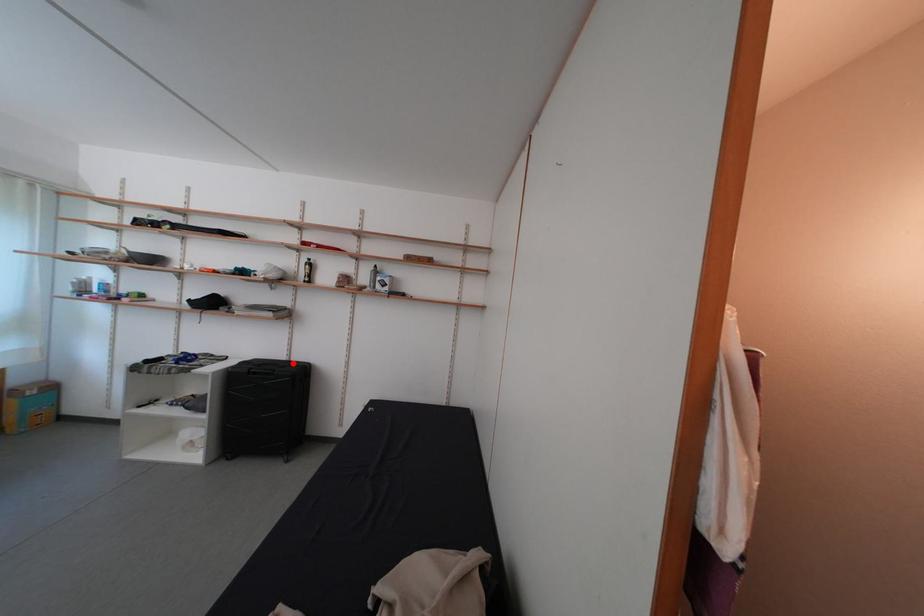
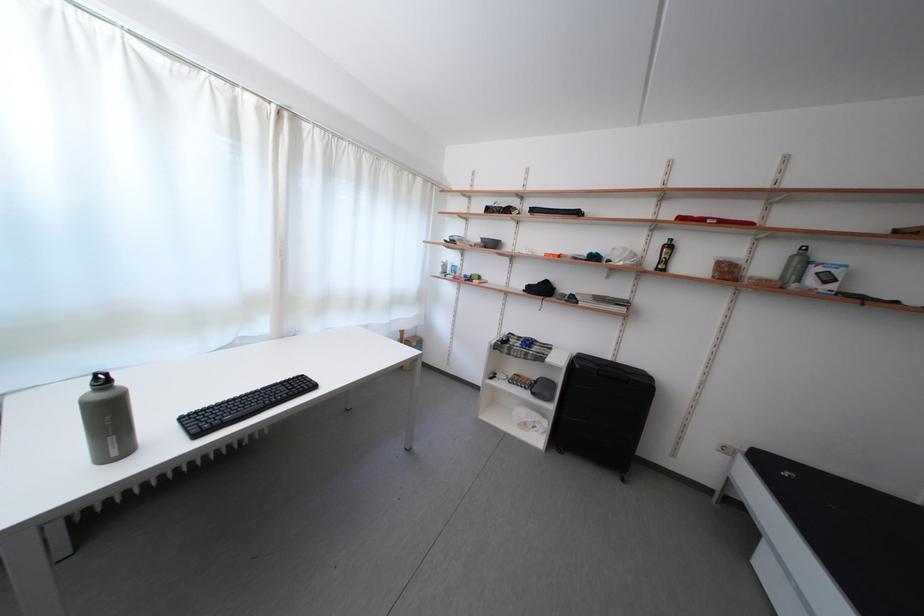
Locate, in the second image, the point that corresponds to the highlighted location in the first image.

(617, 363)